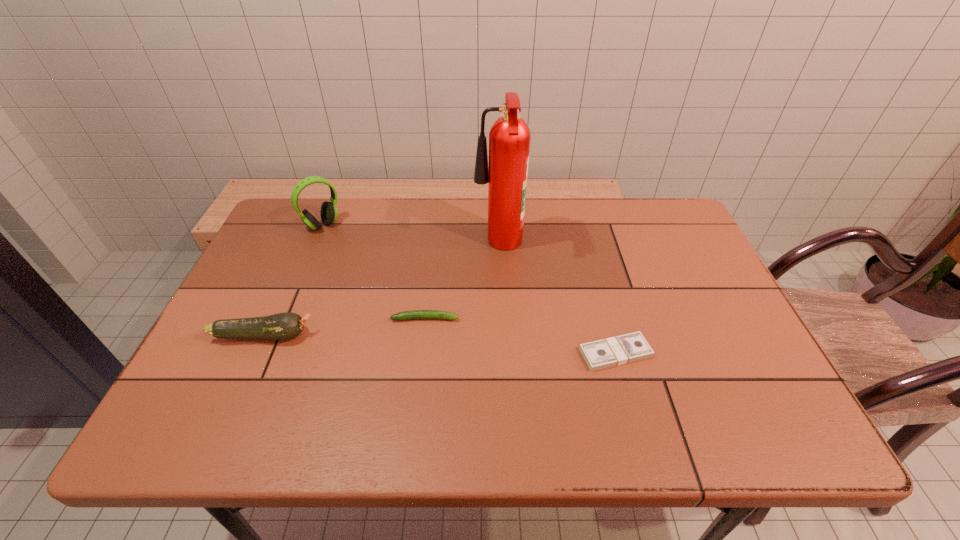
Identify the location of the fourth object from left to right. (509, 138).

Where is `the tallest object`? The width and height of the screenshot is (960, 540). the tallest object is located at coordinates (509, 138).

At what (x,y) coordinates should I click in order to perform the action: click on the second tallest object. Please return your answer as a coordinate pair (x, y). The width and height of the screenshot is (960, 540). Looking at the image, I should click on (328, 212).

The height and width of the screenshot is (540, 960). Identify the location of the third shortest object. (283, 326).

Identify the location of the taller zucchini. (283, 326).

Locate an element on the screen. The width and height of the screenshot is (960, 540). the shorter zucchini is located at coordinates (415, 314).

Where is `the right zucchini`? This screenshot has height=540, width=960. the right zucchini is located at coordinates (415, 314).

Identify the location of the shortest object. tap(618, 350).

The width and height of the screenshot is (960, 540). Identify the location of dollar. (618, 350).

This screenshot has width=960, height=540. Find the location of `free space located at the nozzle of the fire extinguisher`. free space located at the nozzle of the fire extinguisher is located at coordinates (453, 247).